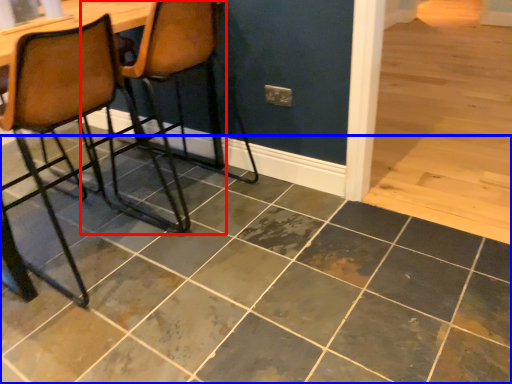
Question: Among these objects, which one is nearest to the camera, chair (highlighted by a red box) or ceramic tile (highlighted by a blue box)?

Choices:
 (A) chair
 (B) ceramic tile

Answer: (B)